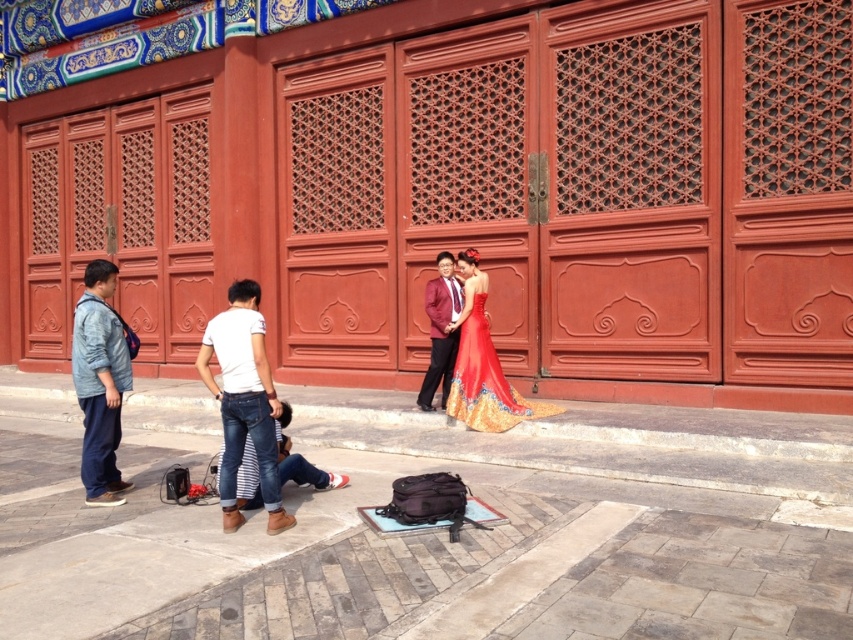
Can you confirm if white denim jeans at center is taller than satin burgundy suit at center?

No, white denim jeans at center is not taller than satin burgundy suit at center.

Image resolution: width=853 pixels, height=640 pixels. I want to click on white denim jeans at center, so click(x=242, y=401).

Between point (223, 380) and point (428, 330), which one is positioned in front?

Point (223, 380) is more forward.

Image resolution: width=853 pixels, height=640 pixels. I want to click on white denim jeans at center, so click(x=242, y=401).

Is white denim jeans at center above shiny satin gown at center?

No.

Who is higher up, white denim jeans at center or shiny satin gown at center?

shiny satin gown at center is higher up.

Find the location of a particular element. The width and height of the screenshot is (853, 640). white denim jeans at center is located at coordinates (242, 401).

Measure the distance between point (x=123, y=387) and camera.

19.58 feet

Who is lower down, denim pants at left or shiny satin gown at center?

denim pants at left

What do you see at coordinates (99, 381) in the screenshot?
I see `denim pants at left` at bounding box center [99, 381].

Where is `denim pants at left`? The height and width of the screenshot is (640, 853). denim pants at left is located at coordinates (99, 381).